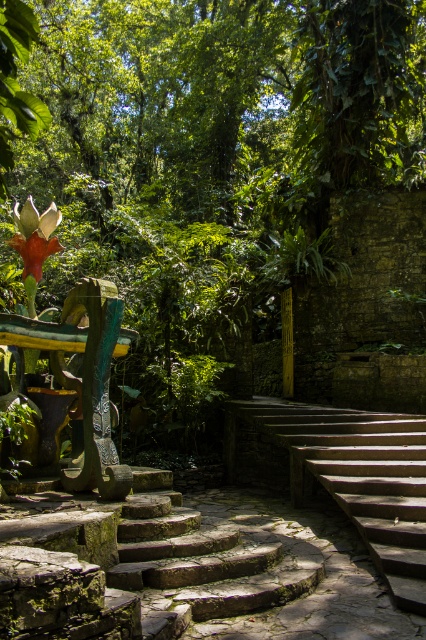
You are a gardener who needs to water the orange matte flower at left. You are currently standing on the green mossy stone stairs at center. Which direction should you move to reach the flower?

The orange matte flower at left is to the left of the green mossy stone stairs at center, so you should move to your left to reach it.

You are a gardener holding a 2.5 meter long hose. You need to water the green mossy stone stairs at center. Can you reach them without moving closer?

The green mossy stone stairs at center are 2.39 meters away from the camera. Since the hose is 2.5 meters long, you can reach them without moving closer.